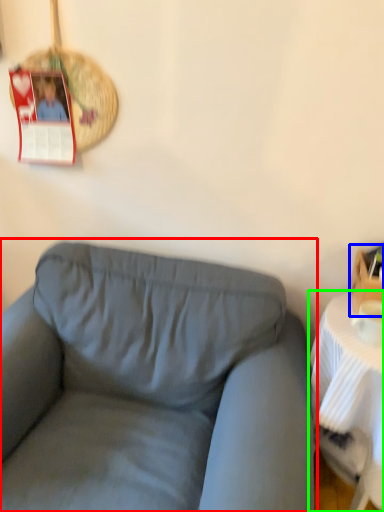
Question: Estimate the real-world distances between objects in this image. Which object is farther from studio couch (highlighted by a red box), box (highlighted by a blue box) or table (highlighted by a green box)?

Choices:
 (A) box
 (B) table

Answer: (A)